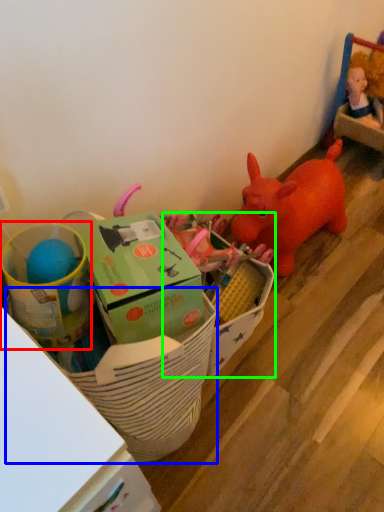
Question: Considering the real-world distances, which object is farthest from toy (highlighted by a red box)? basket (highlighted by a blue box) or storage box (highlighted by a green box)?

Choices:
 (A) basket
 (B) storage box

Answer: (B)